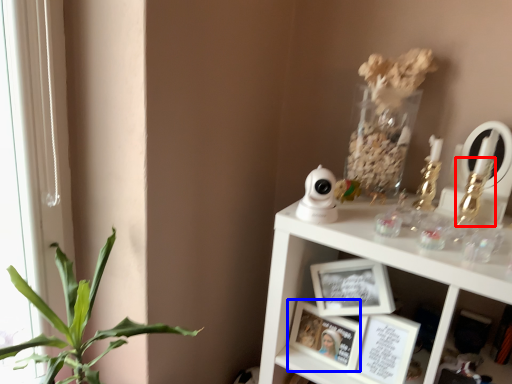
Question: Which point is further to the camera, toy (highlighted by a red box) or picture frame (highlighted by a blue box)?

Choices:
 (A) toy
 (B) picture frame

Answer: (B)